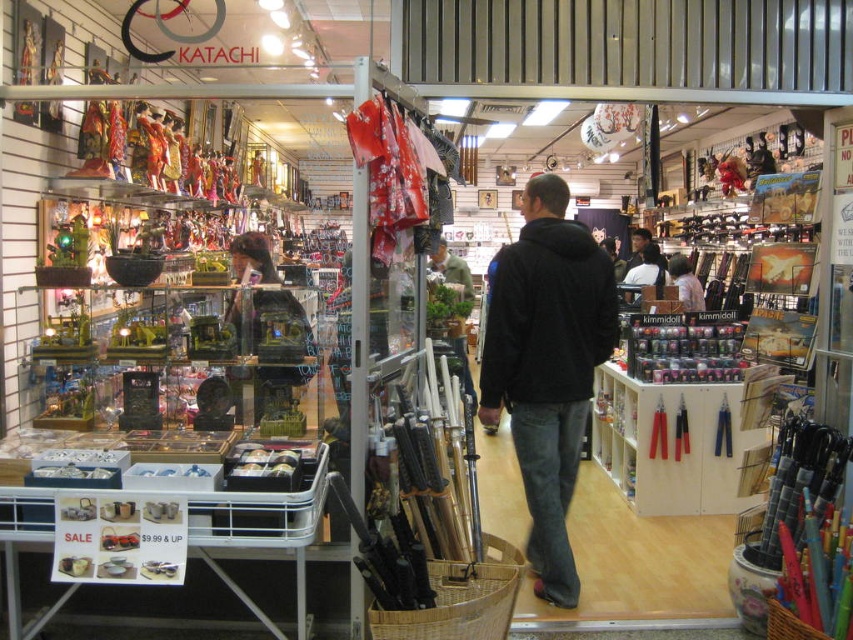
Does black fleece sweatshirt at center come in front of dark brown leather jacket at center?

Yes, it is in front of dark brown leather jacket at center.

Where is `black fleece sweatshirt at center`? This screenshot has height=640, width=853. black fleece sweatshirt at center is located at coordinates (547, 316).

The image size is (853, 640). Find the location of `black fleece sweatshirt at center`. black fleece sweatshirt at center is located at coordinates (547, 316).

Can you confirm if black cotton hoodie at center is positioned above white matte umbrella at center?

No, black cotton hoodie at center is not above white matte umbrella at center.

Can you confirm if black cotton hoodie at center is thinner than white matte umbrella at center?

No, black cotton hoodie at center is not thinner than white matte umbrella at center.

Does point (583, 264) come in front of point (683, 273)?

Yes, it is in front of point (683, 273).

Where is `black cotton hoodie at center`? Image resolution: width=853 pixels, height=640 pixels. black cotton hoodie at center is located at coordinates (547, 365).

Is point (627, 272) behind point (689, 275)?

Yes, it is.

Does dark brown leather jacket at center have a lesser width compared to white matte umbrella at center?

No, dark brown leather jacket at center is not thinner than white matte umbrella at center.

Does point (630, 269) lie in front of point (689, 266)?

That is False.

This screenshot has width=853, height=640. What are the coordinates of `dark brown leather jacket at center` in the screenshot? It's located at (647, 268).